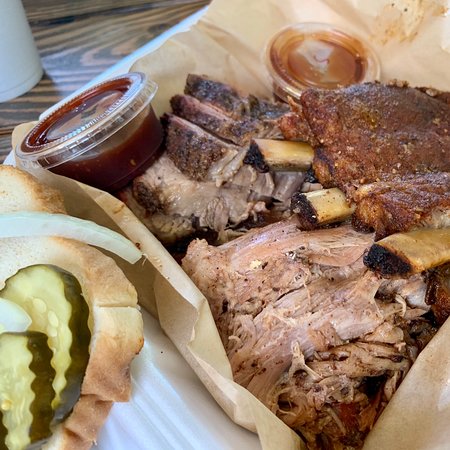
Identify the location of sauce cups. This screenshot has width=450, height=450. (81, 147), (292, 91).